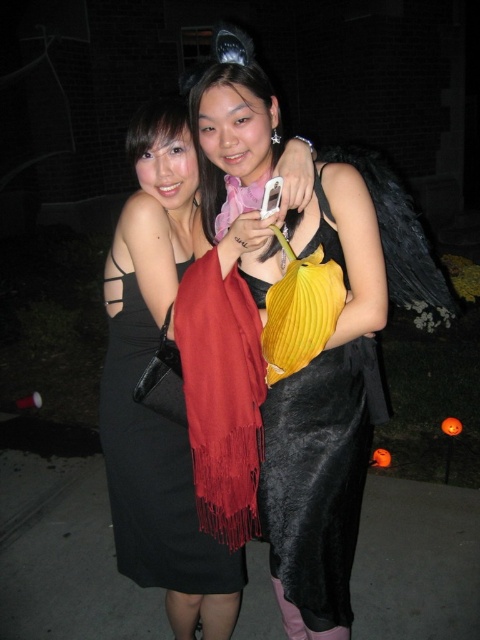
Can you confirm if velvet black dress at center is bigger than black satin dress at center?

Correct, velvet black dress at center is larger in size than black satin dress at center.

In the scene shown: Who is lower down, velvet black dress at center or black satin dress at center?

velvet black dress at center is below.

The width and height of the screenshot is (480, 640). What do you see at coordinates (317, 483) in the screenshot?
I see `velvet black dress at center` at bounding box center [317, 483].

The height and width of the screenshot is (640, 480). Identify the location of velvet black dress at center. (317, 483).